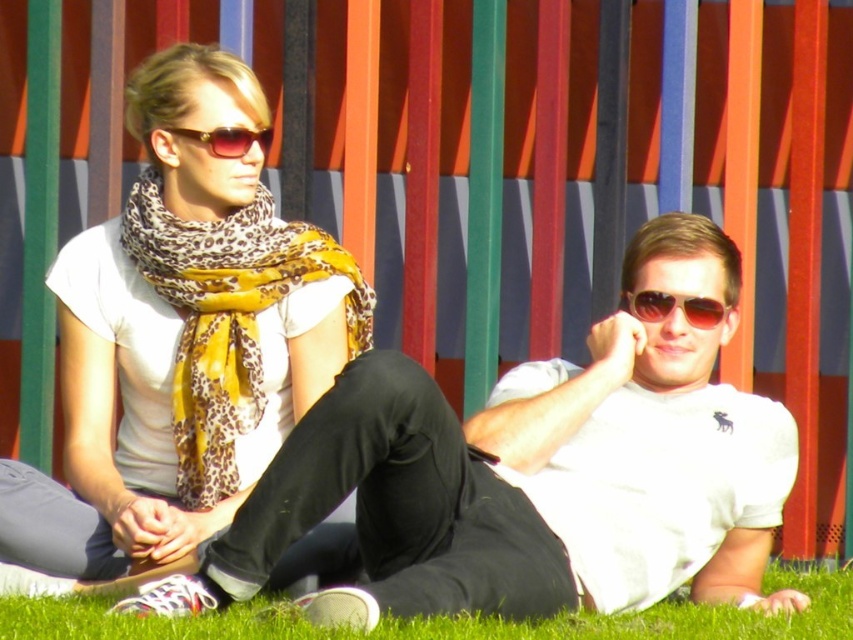
Question: Does white matte shirt at center appear over leopard print scarf at left?

Choices:
 (A) yes
 (B) no

Answer: (B)

Question: Which point appears closest to the camera in this image?

Choices:
 (A) (704, 298)
 (B) (229, 141)

Answer: (A)

Question: Which point is farther to the camera?

Choices:
 (A) (779, 568)
 (B) (683, 310)
 (C) (175, 129)
 (D) (693, 563)

Answer: (A)

Question: Does leopard print scarf at upper left appear on the right side of leopard print scarf at left?

Choices:
 (A) yes
 (B) no

Answer: (B)

Question: Which point is farther from the camera taking this photo?

Choices:
 (A) (16, 611)
 (B) (625, 298)

Answer: (B)

Question: Is leopard print scarf at left wider than sunglasses at center?

Choices:
 (A) yes
 (B) no

Answer: (A)